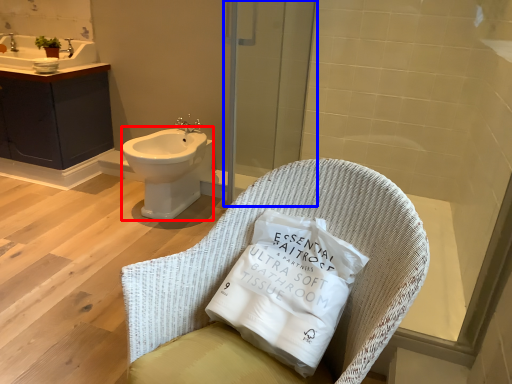
Question: Which point is closer to the camera, bidet (highlighted by a red box) or screen door (highlighted by a blue box)?

Choices:
 (A) bidet
 (B) screen door

Answer: (B)